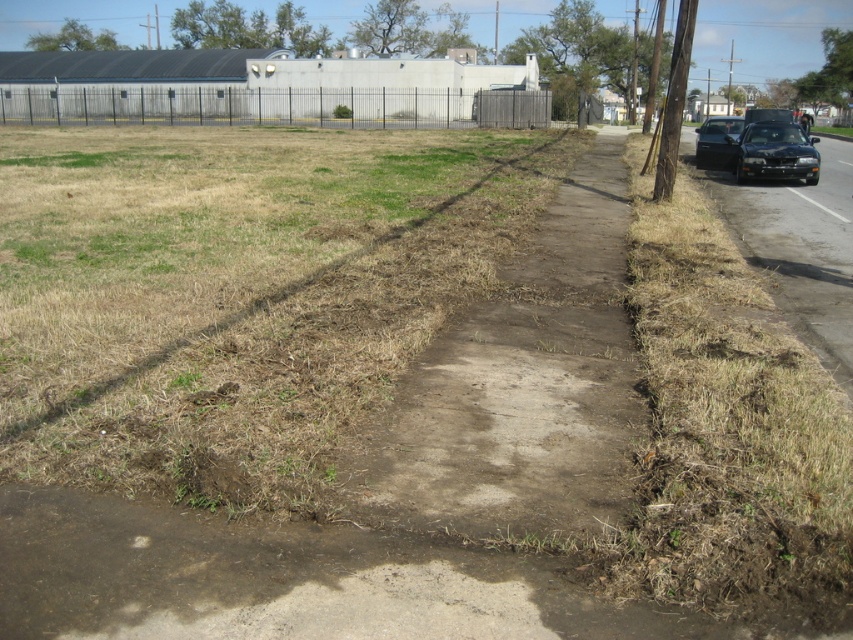
Is black metal fence at upper left further to the viewer compared to black glossy car at right?

Yes, it is behind black glossy car at right.

Is black metal fence at upper left above black glossy car at right?

Yes, black metal fence at upper left is above black glossy car at right.

At what (x,y) coordinates should I click in order to perform the action: click on black metal fence at upper left. Please return your answer as a coordinate pair (x, y). This screenshot has height=640, width=853. Looking at the image, I should click on (279, 106).

Which is above, shiny black sedan at right or black glossy car at right?

Positioned higher is black glossy car at right.

Is shiny black sedan at right shorter than black glossy car at right?

Correct, shiny black sedan at right is not as tall as black glossy car at right.

I want to click on shiny black sedan at right, so click(x=775, y=152).

At what (x,y) coordinates should I click in order to perform the action: click on shiny black sedan at right. Please return your answer as a coordinate pair (x, y). This screenshot has height=640, width=853. Looking at the image, I should click on (775, 152).

Does black metal fence at upper left appear on the left side of shiny black sedan at right?

Correct, you'll find black metal fence at upper left to the left of shiny black sedan at right.

Is black metal fence at upper left smaller than shiny black sedan at right?

Incorrect, black metal fence at upper left is not smaller in size than shiny black sedan at right.

Locate an element on the screen. black metal fence at upper left is located at coordinates (279, 106).